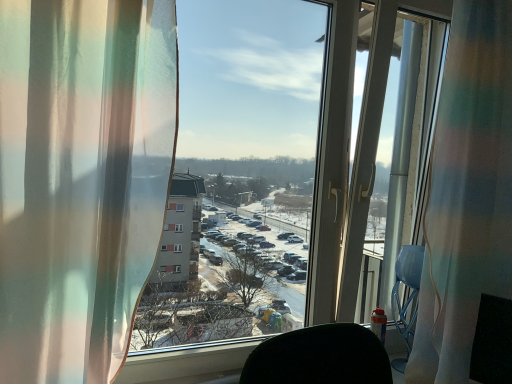
Question: Based on their sizes in the image, would you say translucent sheer curtain at left, which is the first curtain from front to back, is bigger or smaller than translucent fabric at center?

Choices:
 (A) big
 (B) small

Answer: (B)

Question: Would you say translucent sheer curtain at left, arranged as the 2th curtain when viewed from the back, is to the left or to the right of translucent fabric at center in the picture?

Choices:
 (A) left
 (B) right

Answer: (A)

Question: Which of these objects is positioned closest to the translucent fabric at center?

Choices:
 (A) translucent fabric curtain at right, which ranks as the first curtain in back-to-front order
 (B) translucent sheer curtain at left, arranged as the 2th curtain when viewed from the back

Answer: (A)

Question: Which object is positioned farthest from the translucent sheer curtain at left, arranged as the 2th curtain when viewed from the back?

Choices:
 (A) translucent fabric at center
 (B) translucent fabric curtain at right, arranged as the first curtain when viewed from the right

Answer: (A)